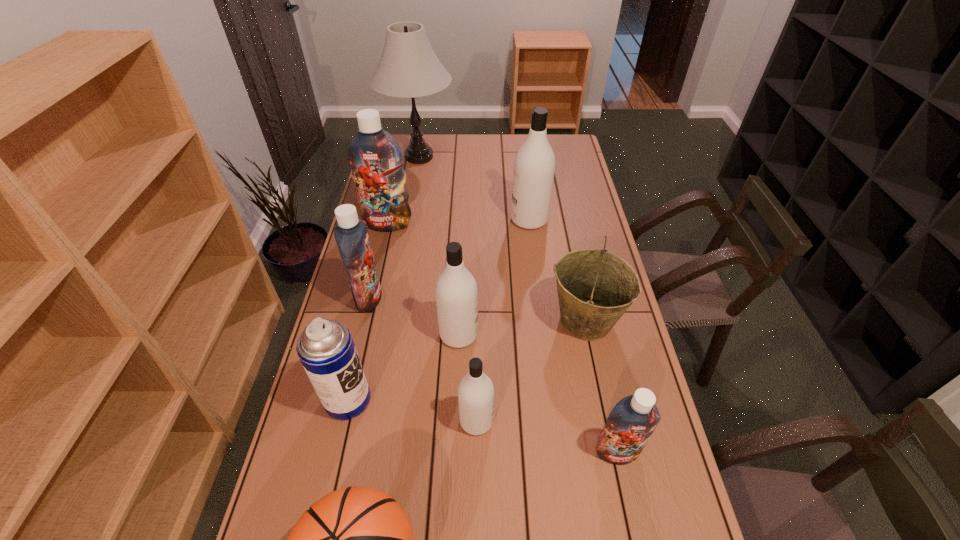
You are a GUI agent. You are given a task and a screenshot of the screen. Output one action in this format:
    pyautogui.click(x=<x>, y=<y>)
    Task: Click on the shampoo present at the right edge
    This screenshot has height=540, width=960.
    Given the screenshot: What is the action you would take?
    pyautogui.click(x=630, y=424)

The width and height of the screenshot is (960, 540). Identify the location of object at the far left corner. (408, 68).

The height and width of the screenshot is (540, 960). Find the location of `free space at the far edge`. free space at the far edge is located at coordinates (472, 139).

This screenshot has width=960, height=540. I want to click on blank area at the left edge, so click(374, 346).

You are a GUI agent. You are given a task and a screenshot of the screen. Output one action in this format:
    pyautogui.click(x=<x>, y=<y>)
    Task: Click on the vacant region at the right edge of the desktop
    
    Given the screenshot: What is the action you would take?
    pyautogui.click(x=577, y=218)

Find the location of `free space at the far right corner of the desktop`. free space at the far right corner of the desktop is located at coordinates (574, 148).

Find the location of a particular element. free space between the second nearest white shampoo and the farthest blue shampoo is located at coordinates (423, 279).

The width and height of the screenshot is (960, 540). What are the coordinates of `vacant space that is in between the biggest blue shampoo and the smallest blue shampoo` in the screenshot? It's located at (502, 338).

I want to click on empty space between the wine bucket and the lamp, so click(x=502, y=239).

The height and width of the screenshot is (540, 960). Find the location of `blank region between the aerosol can and the fourth farthest shampoo`. blank region between the aerosol can and the fourth farthest shampoo is located at coordinates (403, 367).